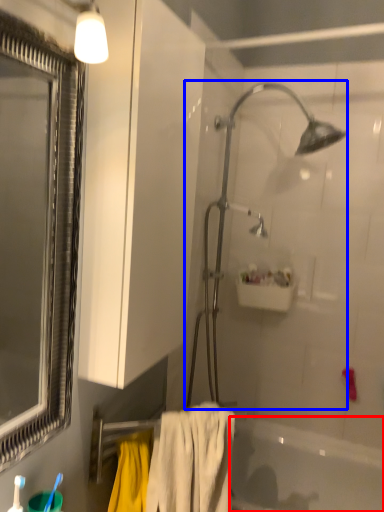
Question: Which object appears closest to the camera in this image, bathtub (highlighted by a red box) or shower (highlighted by a blue box)?

Choices:
 (A) bathtub
 (B) shower

Answer: (A)